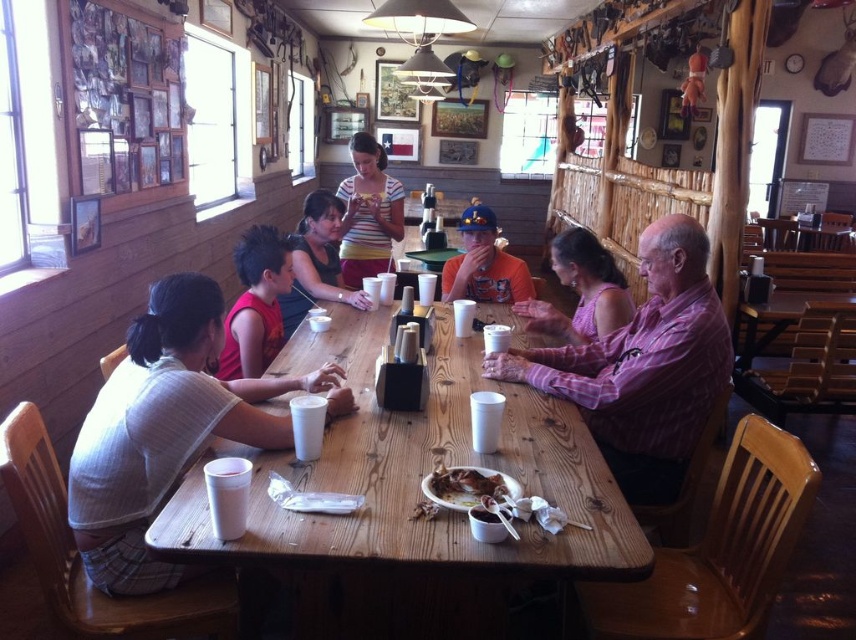
Based on the photo, you are a restaurant employee who needs to fold the white striped shirt at left and the matte black shirt at center. Which shirt will require more space when folded?

The matte black shirt at center is larger than the white striped shirt at left, so it will require more space when folded.

You are a server in a busy diner and need to deliver a tray of dishes to the table. The tray is 4 feet wide. There is a pink plaid shirt at center and a red sleeveless shirt at left at the table. Can you safely place the tray between them without it touching either shirt?

The distance between the pink plaid shirt at center and the red sleeveless shirt at left is 4.13 feet. Since the tray is 4 feet wide, it can be placed between them safely as there is enough space.